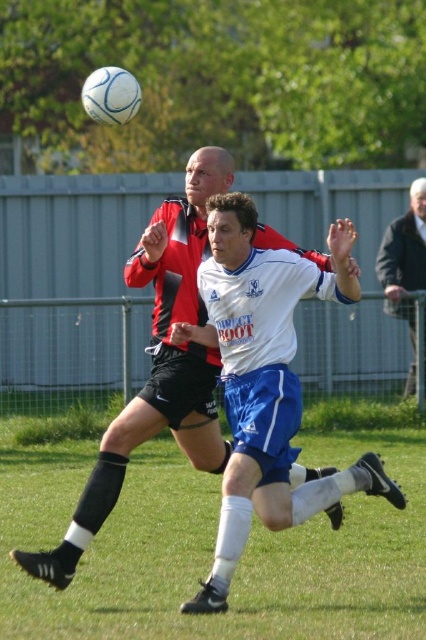
You are a soccer player preparing to take a penalty kick. You notice the green grass at center and the black matte shorts at center in your line of sight. Which object is closer to the ground?

The green grass at center is shorter than the black matte shorts at center, so the green grass at center is closer to the ground.

You are a soccer player trying to kick the ball. You notice the green grass at center and the black matte shorts at center. Which object is closer to the ground?

The green grass at center is located below black matte shorts at center, so it is closer to the ground.

You are a soccer coach analyzing the play. The black matte shorts at center belongs to your player, and the dark gray wool jacket at right is an opponent. The ball is near the center. You want to ensure your player can reach the ball before the opponent. Based on their positions, can your player get to the ball first?

The black matte shorts at center and dark gray wool jacket at right are 7.22 meters apart. Since the ball is near the center, your player is closer to the ball than the opponent, so your player can reach it first.